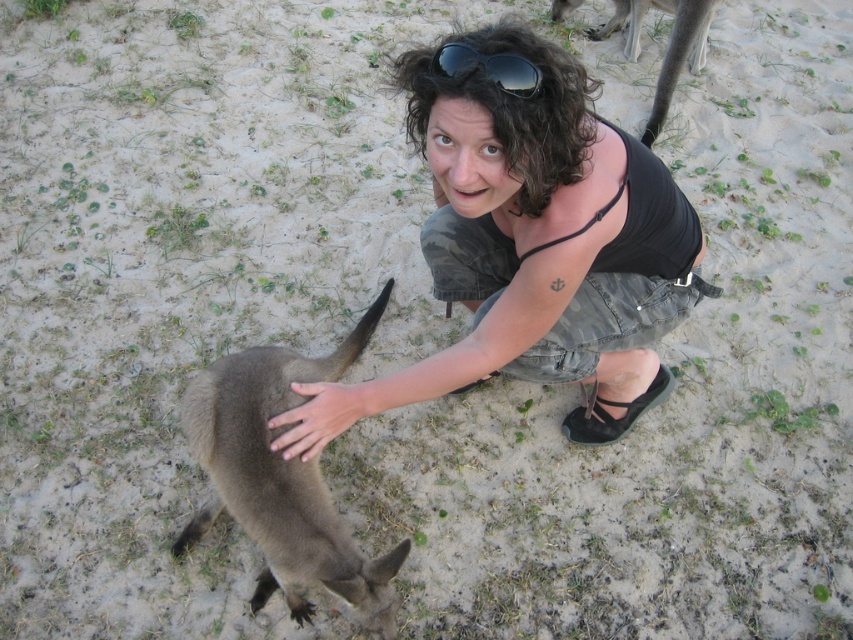
Is matte black tank top at center positioned before brown fur kangaroo at lower left?

That is True.

Does matte black tank top at center appear over brown fur kangaroo at lower left?

Yes, matte black tank top at center is above brown fur kangaroo at lower left.

Describe the element at coordinates (532, 248) in the screenshot. This screenshot has height=640, width=853. I see `matte black tank top at center` at that location.

Locate an element on the screen. The width and height of the screenshot is (853, 640). matte black tank top at center is located at coordinates (532, 248).

Which of these two, brown fur kangaroo at lower left or black reflective sunglasses at upper center, stands shorter?

black reflective sunglasses at upper center

This screenshot has width=853, height=640. I want to click on brown fur kangaroo at lower left, so click(282, 480).

Consider the image. Who is more distant from viewer, (349, 358) or (538, 80)?

The point (349, 358) is behind.

Find the location of a particular element. The width and height of the screenshot is (853, 640). brown fur kangaroo at lower left is located at coordinates (282, 480).

Measure the distance between matte black tank top at center and brown fur at lower right.

matte black tank top at center is 6.22 feet from brown fur at lower right.

Consider the image. Is matte black tank top at center positioned in front of brown fur at lower right?

Yes, it is in front of brown fur at lower right.

The image size is (853, 640). Identify the location of matte black tank top at center. (532, 248).